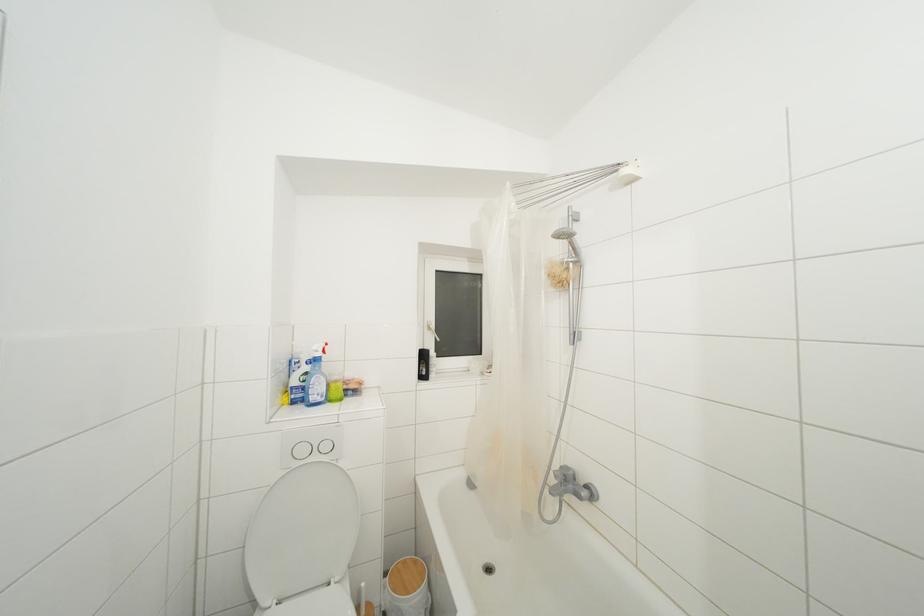
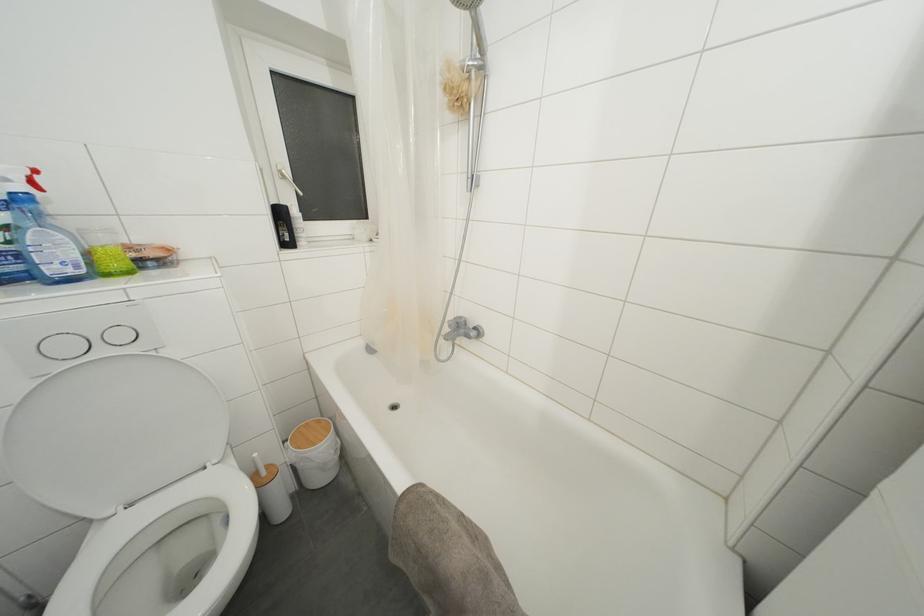
Find the pixel in the second image that matches pixel 576 248 in the first image.

(480, 31)